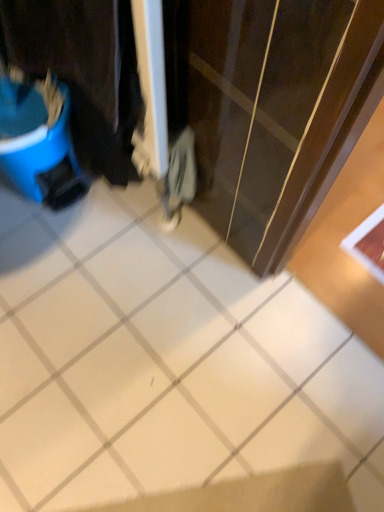
Locate an element on the screen. This screenshot has height=512, width=384. white glossy tile at center is located at coordinates (170, 366).

Describe the element at coordinates (170, 366) in the screenshot. I see `white glossy tile at center` at that location.

What do you see at coordinates (83, 71) in the screenshot?
I see `blue plastic bucket at left` at bounding box center [83, 71].

This screenshot has height=512, width=384. Find the location of `blue plastic bucket at left`. blue plastic bucket at left is located at coordinates (83, 71).

This screenshot has width=384, height=512. Find the location of `white glossy tile at center`. white glossy tile at center is located at coordinates (170, 366).

Which object is positioned more to the left, white glossy tile at center or blue plastic bucket at left?

blue plastic bucket at left.

Between white glossy tile at center and blue plastic bucket at left, which one is positioned behind?

blue plastic bucket at left is behind.

Does point (342, 374) lie behind point (69, 24)?

Yes, point (342, 374) is behind point (69, 24).

From the image's perspective, between white glossy tile at center and blue plastic bucket at left, who is located below?

white glossy tile at center is shown below in the image.

From a real-world perspective, between white glossy tile at center and blue plastic bucket at left, who is vertically higher?

From a 3D spatial view, blue plastic bucket at left is above.

Which object is wider, white glossy tile at center or blue plastic bucket at left?

Wider between the two is white glossy tile at center.

Considering the relative sizes of white glossy tile at center and blue plastic bucket at left in the image provided, is white glossy tile at center shorter than blue plastic bucket at left?

Correct, white glossy tile at center is not as tall as blue plastic bucket at left.

Considering the relative sizes of white glossy tile at center and blue plastic bucket at left in the image provided, is white glossy tile at center smaller than blue plastic bucket at left?

Yes, white glossy tile at center is smaller than blue plastic bucket at left.

Looking at this image, is blue plastic bucket at left inside white glossy tile at center?

That's incorrect, blue plastic bucket at left is not inside white glossy tile at center.

Would you say white glossy tile at center is a long distance from blue plastic bucket at left?

They are positioned close to each other.

Could you tell me if white glossy tile at center is facing blue plastic bucket at left?

No, white glossy tile at center does not turn towards blue plastic bucket at left.

At what (x,y) coordinates should I click in order to perform the action: click on laundry that appears above the white glossy tile at center (from a real-world perspective). Please return your answer as a coordinate pair (x, y). The image size is (384, 512). Looking at the image, I should click on (83, 71).

Between blue plastic bucket at left and white glossy tile at center, which one appears on the right side from the viewer's perspective?

Positioned to the right is white glossy tile at center.

Which object is further away from the camera taking this photo, blue plastic bucket at left or white glossy tile at center?

blue plastic bucket at left is behind.

Based on the photo, which is closer to the camera, (116, 170) or (351, 376)?

The point (351, 376) is closer to the camera.

From the image's perspective, which object appears higher, blue plastic bucket at left or white glossy tile at center?

blue plastic bucket at left is shown above in the image.

From a real-world perspective, is blue plastic bucket at left over white glossy tile at center?

Correct, in the physical world, blue plastic bucket at left is higher than white glossy tile at center.

Is blue plastic bucket at left wider or thinner than white glossy tile at center?

Considering their sizes, blue plastic bucket at left looks slimmer than white glossy tile at center.

Who is shorter, blue plastic bucket at left or white glossy tile at center?

With less height is white glossy tile at center.

Can you confirm if blue plastic bucket at left is bigger than white glossy tile at center?

Yes, blue plastic bucket at left is bigger than white glossy tile at center.

Is white glossy tile at center surrounded by blue plastic bucket at left?

No.

Are blue plastic bucket at left and white glossy tile at center located far from each other?

Actually, blue plastic bucket at left and white glossy tile at center are a little close together.

Is blue plastic bucket at left positioned with its back to white glossy tile at center?

No, blue plastic bucket at left is not facing the opposite direction of white glossy tile at center.

How many degrees apart are the facing directions of blue plastic bucket at left and white glossy tile at center?

They differ by 179 degrees in their facing directions.

I want to click on ceramic tile that is below the blue plastic bucket at left (from the image's perspective), so click(x=170, y=366).

The width and height of the screenshot is (384, 512). I want to click on ceramic tile that is in front of the blue plastic bucket at left, so click(x=170, y=366).

Identify the location of laundry above the white glossy tile at center (from the image's perspective). The image size is (384, 512). (83, 71).